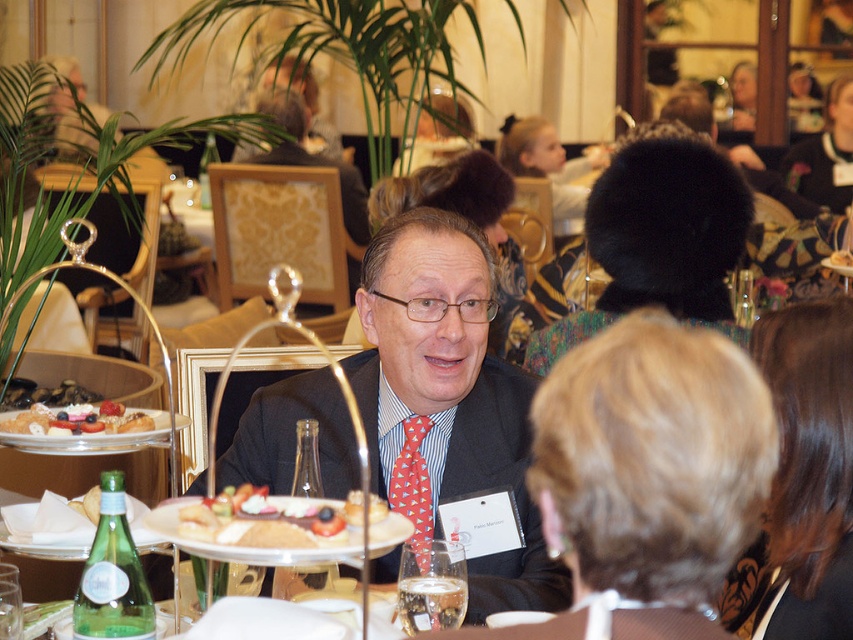
Between matte black suit at center and smooth cream cheese spread at center, which one is positioned higher?

Positioned higher is matte black suit at center.

From the picture: Between matte black suit at center and smooth cream cheese spread at center, which one has less height?

With less height is smooth cream cheese spread at center.

Which is behind, point (431, 396) or point (335, 540)?

The point (431, 396) is more distant.

The image size is (853, 640). In order to click on matte black suit at center in this screenshot , I will do `click(450, 394)`.

From the picture: Does clear glass wine glass at lower center have a greater height compared to red silk tie at center?

No.

Who is more forward, [405,577] or [427,518]?

Positioned in front is point [405,577].

Locate an element on the screen. clear glass wine glass at lower center is located at coordinates point(431,586).

This screenshot has width=853, height=640. What do you see at coordinates (431, 586) in the screenshot? I see `clear glass wine glass at lower center` at bounding box center [431, 586].

Looking at this image, is clear glass wine glass at lower center above smooth cream cake at left?

No, clear glass wine glass at lower center is not above smooth cream cake at left.

This screenshot has height=640, width=853. What do you see at coordinates (431, 586) in the screenshot?
I see `clear glass wine glass at lower center` at bounding box center [431, 586].

Locate an element on the screen. The image size is (853, 640). clear glass wine glass at lower center is located at coordinates pyautogui.click(x=431, y=586).